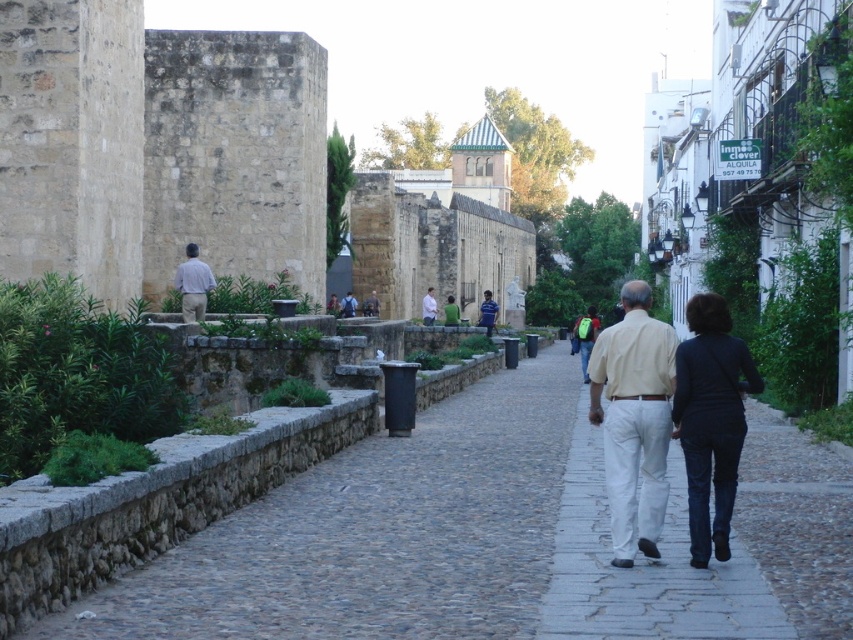
Does beige cotton shirt at center have a smaller size compared to light brown shirt at left?

No, beige cotton shirt at center is not smaller than light brown shirt at left.

Does beige cotton shirt at center have a lesser width compared to light brown shirt at left?

Yes.

Is point (625, 448) more distant than point (190, 289)?

No.

At what (x,y) coordinates should I click in order to perform the action: click on beige cotton shirt at center. Please return your answer as a coordinate pair (x, y). This screenshot has height=640, width=853. Looking at the image, I should click on (634, 420).

Does point (200, 298) come in front of point (433, 304)?

Yes, it is.

You are a GUI agent. You are given a task and a screenshot of the screen. Output one action in this format:
    pyautogui.click(x=<x>, y=<y>)
    Task: Click on the light brown shirt at left
    
    Given the screenshot: What is the action you would take?
    [x=193, y=284]

Who is more distant from viewer, (642, 429) or (431, 321)?

Positioned behind is point (431, 321).

You are a GUI agent. You are given a task and a screenshot of the screen. Output one action in this format:
    pyautogui.click(x=<x>, y=<y>)
    Task: Click on the beige cotton shirt at center
    The height and width of the screenshot is (640, 853).
    Given the screenshot: What is the action you would take?
    pyautogui.click(x=634, y=420)